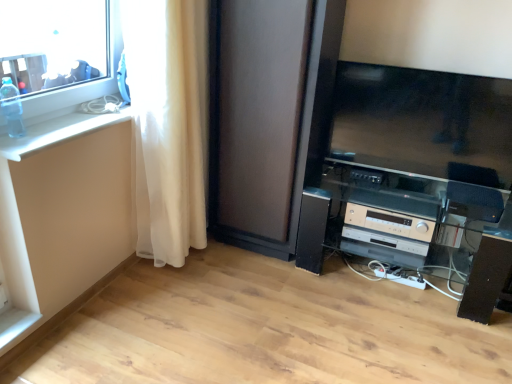
The width and height of the screenshot is (512, 384). What are the coordinates of `free location to the right of white sheer curtain at left` in the screenshot? It's located at (243, 270).